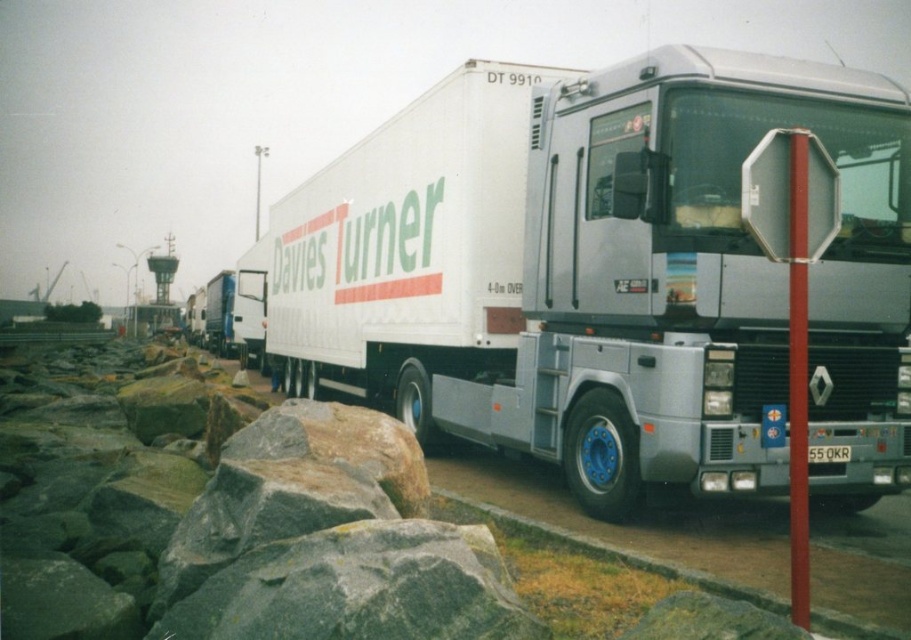
Question: Among these points, which one is farthest from the camera?

Choices:
 (A) (760, 204)
 (B) (787, 349)

Answer: (B)

Question: Is metallic reflective octagonal sign at center-right bigger than red plastic pole at center right?

Choices:
 (A) yes
 (B) no

Answer: (B)

Question: Which point is closer to the camera?

Choices:
 (A) (796, 403)
 (B) (756, 216)
 (C) (340, 186)

Answer: (A)

Question: Which of the following is the farthest from the observer?

Choices:
 (A) white matte trailer truck at center
 (B) red plastic pole at center right
 (C) metallic reflective octagonal sign at center-right

Answer: (A)

Question: Where is metallic reflective octagonal sign at center-right located in relation to red plastic pole at center right in the image?

Choices:
 (A) right
 (B) left

Answer: (B)

Question: Does white matte trailer truck at center have a greater width compared to red plastic pole at center right?

Choices:
 (A) no
 (B) yes

Answer: (B)